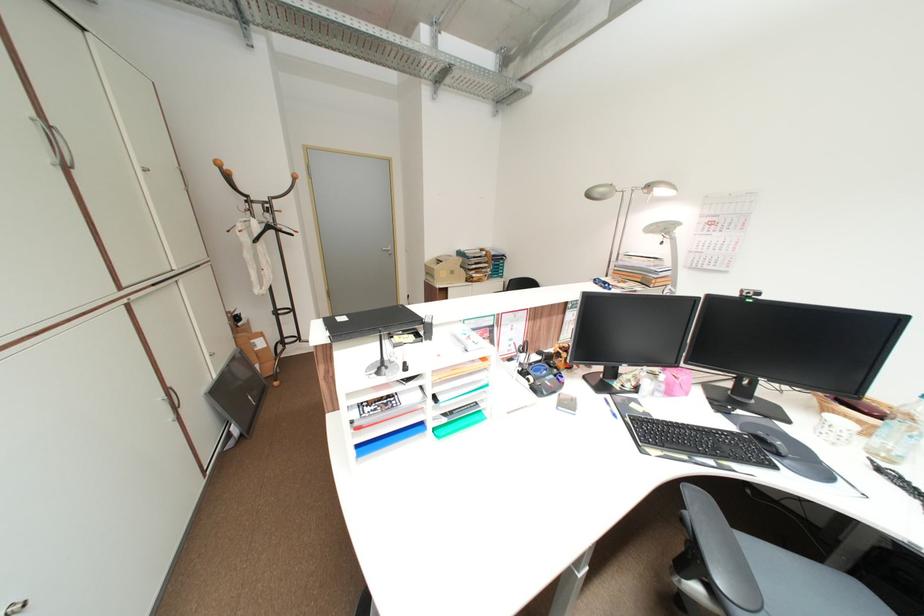
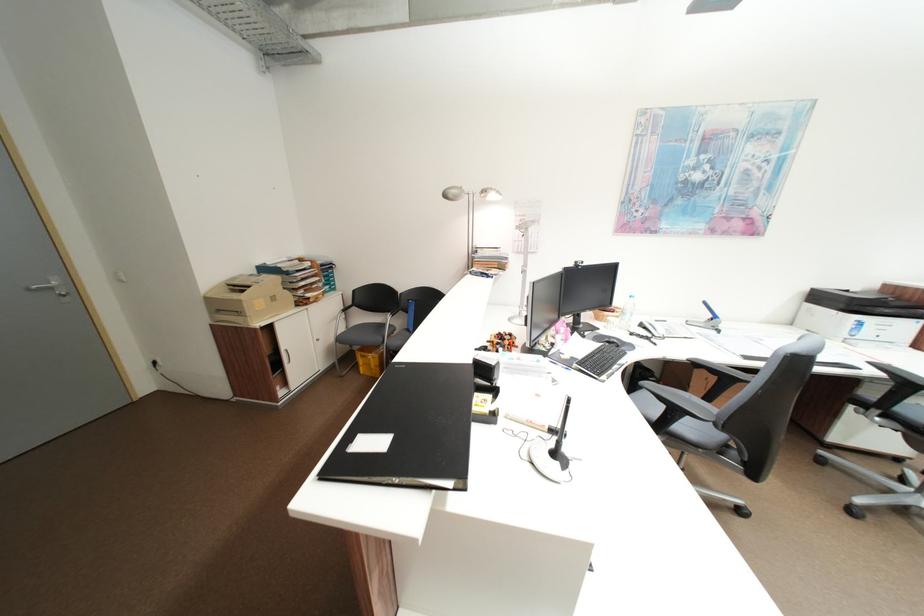
Question: The camera is either moving clockwise (left) or counter-clockwise (right) around the object. The first image is from the beginning of the video and the second image is from the end. Is the camera moving left or right when shooting the video?

Choices:
 (A) Left
 (B) Right

Answer: (A)